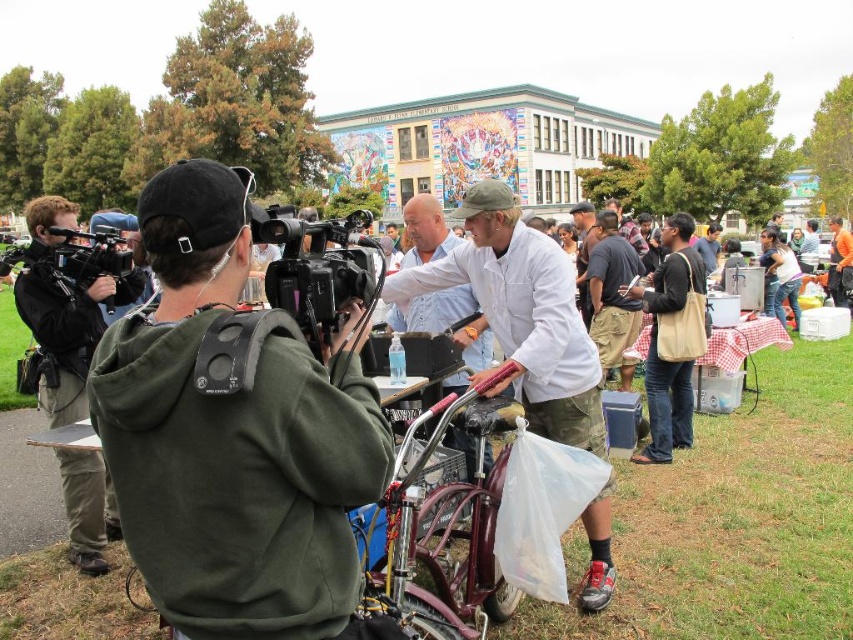
Measure the distance from white matte coat at center to maroon metallic bicycle at center.

The distance of white matte coat at center from maroon metallic bicycle at center is 17.24 feet.

Find the location of a particular element. This screenshot has width=853, height=640. white matte coat at center is located at coordinates (521, 314).

Where is `white matte coat at center`? This screenshot has width=853, height=640. white matte coat at center is located at coordinates (521, 314).

Can you confirm if maroon metallic bicycle at center is thinner than matte black camera at left?

Yes.

Is maroon metallic bicycle at center positioned at the back of matte black camera at left?

No.

Is point (399, 461) in front of point (41, 211)?

Yes, point (399, 461) is in front of point (41, 211).

I want to click on maroon metallic bicycle at center, so click(440, 531).

Describe the element at coordinates (521, 314) in the screenshot. The image size is (853, 640). I see `white matte coat at center` at that location.

Based on the photo, is white matte coat at center below black plastic video camera at center?

Yes, white matte coat at center is below black plastic video camera at center.

Locate an element on the screen. The image size is (853, 640). white matte coat at center is located at coordinates (521, 314).

Where is `white matte coat at center`? This screenshot has height=640, width=853. white matte coat at center is located at coordinates (521, 314).